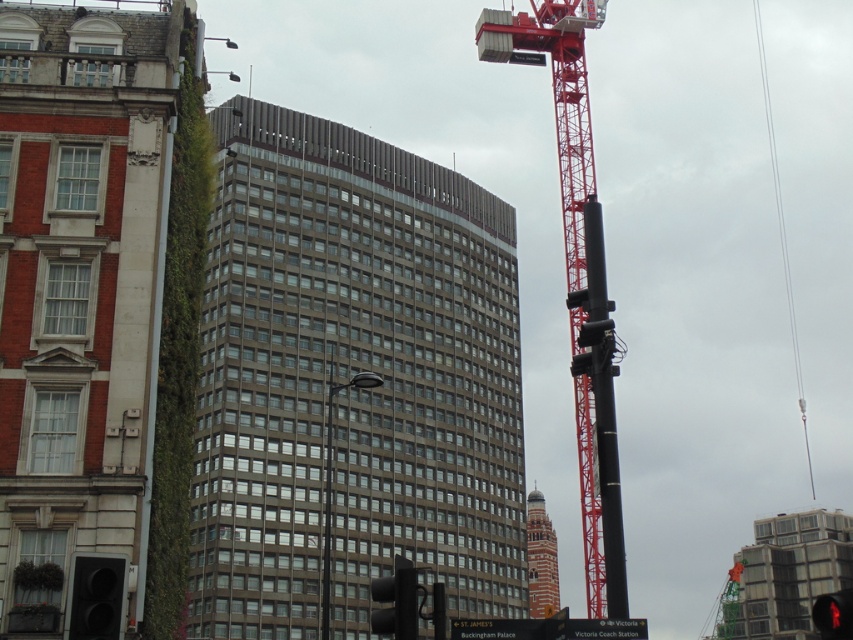
Is black matte pole at right to the right of brick tower at center from the viewer's perspective?

No, black matte pole at right is not to the right of brick tower at center.

Is black matte pole at right wider than brick tower at center?

In fact, black matte pole at right might be narrower than brick tower at center.

Where is `black matte pole at right`? Image resolution: width=853 pixels, height=640 pixels. black matte pole at right is located at coordinates (602, 404).

In the scene shown: Between brown glass building at center and black matte pole at right, which one is positioned higher?

black matte pole at right is higher up.

Is point (302, 164) closer to viewer compared to point (618, 556)?

No, (302, 164) is behind (618, 556).

Find the location of a particular element. The image size is (853, 640). brown glass building at center is located at coordinates (351, 378).

Does red metal crane at right have a smaller size compared to black matte traffic light at lower left?

No, red metal crane at right is not smaller than black matte traffic light at lower left.

Who is positioned more to the left, red metal crane at right or black matte traffic light at lower left?

From the viewer's perspective, black matte traffic light at lower left appears more on the left side.

The height and width of the screenshot is (640, 853). What are the coordinates of `red metal crane at right` in the screenshot? It's located at (575, 273).